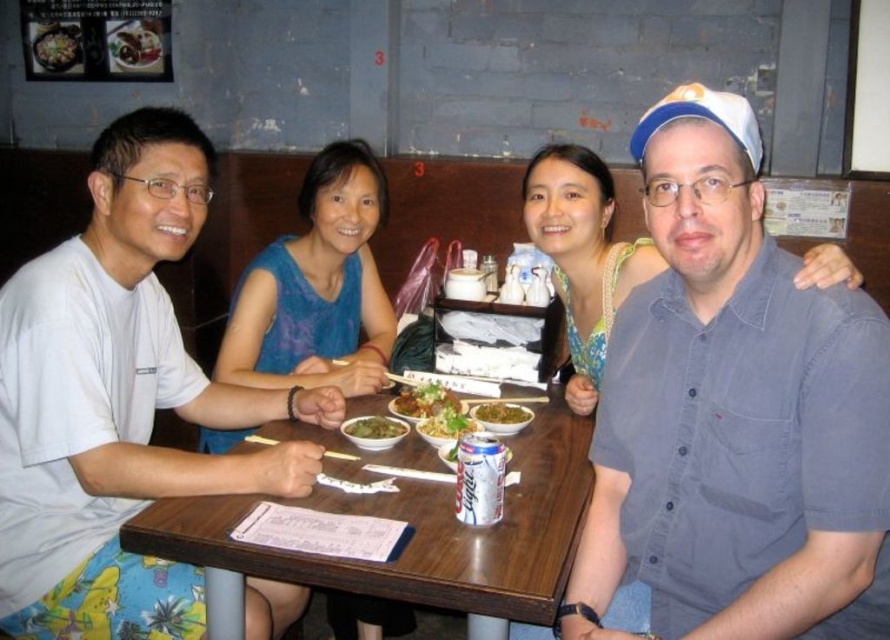
You are a server in a restaurant and need to deliver a drink to the customer wearing the blue denim shirt at right. The table is 1.2 meters long. Can you place the drink on the table without it being too far from the customer?

The blue denim shirt at right and viewer are 98.98 centimeters apart. Since the table is 1.2 meters long, placing the drink near the edge closest to the blue denim shirt at right would ensure it is within reach, as 98.98 cm is less than the table length.

You are sitting at the wooden table in the image and want to reach both the point at (446, 548) and the point at (456, 400). Which point should you reach for first if you want to grab the item closer to you?

You should reach for point (446, 548) first because it is in front of point (456, 400), making it closer to you.